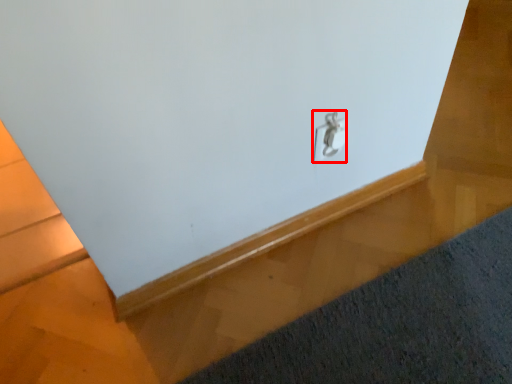
Question: From the image, what is the correct spatial relationship of lock (annotated by the red box) in relation to mat?

Choices:
 (A) right
 (B) left

Answer: (B)